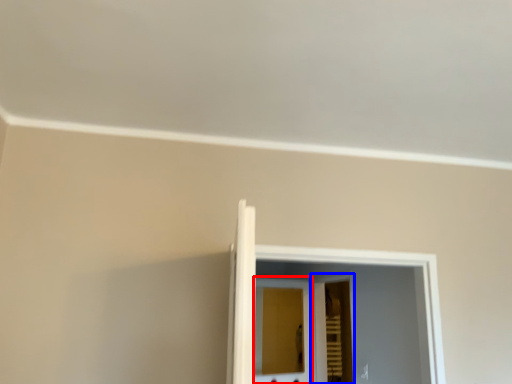
Question: Which object is further to the camera taking this photo, screen door (highlighted by a red box) or screen door (highlighted by a blue box)?

Choices:
 (A) screen door
 (B) screen door

Answer: (A)